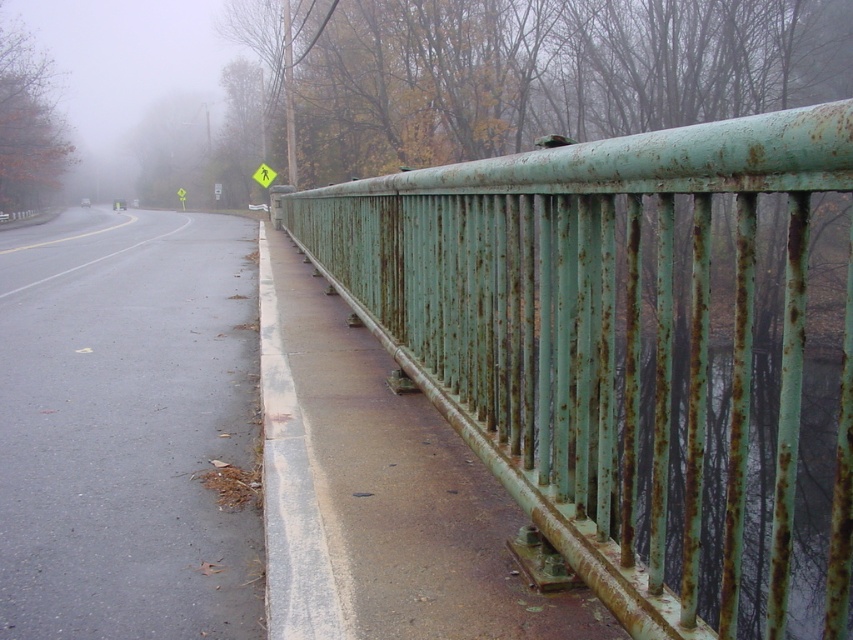
You are a delivery person trying to cross the road safely. You see a rusty green metal fence at right and a yellow paper pedestrian at upper center. Which object is closer to the road surface?

The rusty green metal fence at right is closer to the road surface because it is below the yellow paper pedestrian at upper center.

Based on the photo, you are a delivery person trying to cross the road safely. You notice a rusty green metal fence at right and a yellow paper pedestrian at upper center. Which object is wider in the image?

The rusty green metal fence at right is wider than the yellow paper pedestrian at upper center.